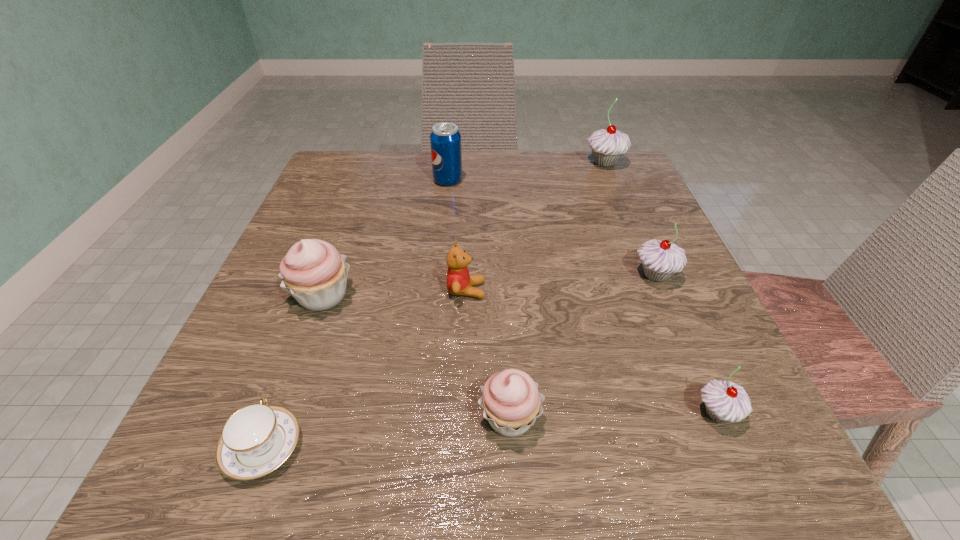
This screenshot has height=540, width=960. I want to click on the shortest object, so tap(258, 438).

Where is `blue teacup`? blue teacup is located at coordinates (258, 438).

Where is `vacant space located on the left of the tallest cupcake`? The width and height of the screenshot is (960, 540). vacant space located on the left of the tallest cupcake is located at coordinates (493, 163).

This screenshot has width=960, height=540. I want to click on vacant space situated 0.090m on the back of the blue pop soda, so click(x=450, y=154).

In order to click on free space located on the back of the left pink cupcake in this screenshot , I will do `click(362, 188)`.

Identify the location of vacant region located 0.060m on the front of the second smallest gray cupcake. (673, 317).

Image resolution: width=960 pixels, height=540 pixels. I want to click on free location located 0.300m on the front-facing side of the red teddy bear, so click(662, 290).

Where is `vacant space located on the front of the nearest gray cupcake`? This screenshot has height=540, width=960. vacant space located on the front of the nearest gray cupcake is located at coordinates pos(744,475).

The image size is (960, 540). I want to click on vacant region located 0.090m on the right of the second cupcake from left to right, so click(x=612, y=417).

This screenshot has height=540, width=960. Identify the location of free space located 0.270m on the side with the handle of the shortest object. (327, 273).